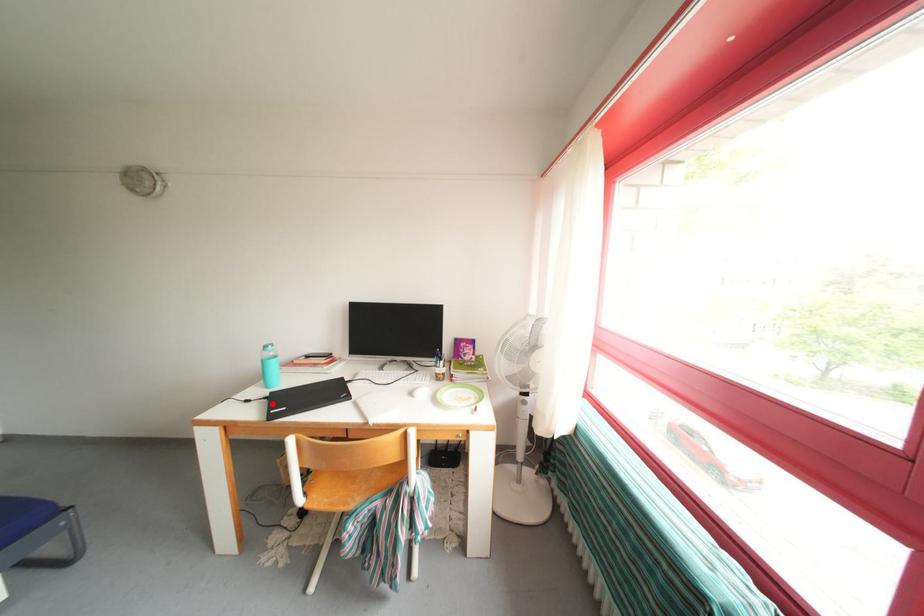
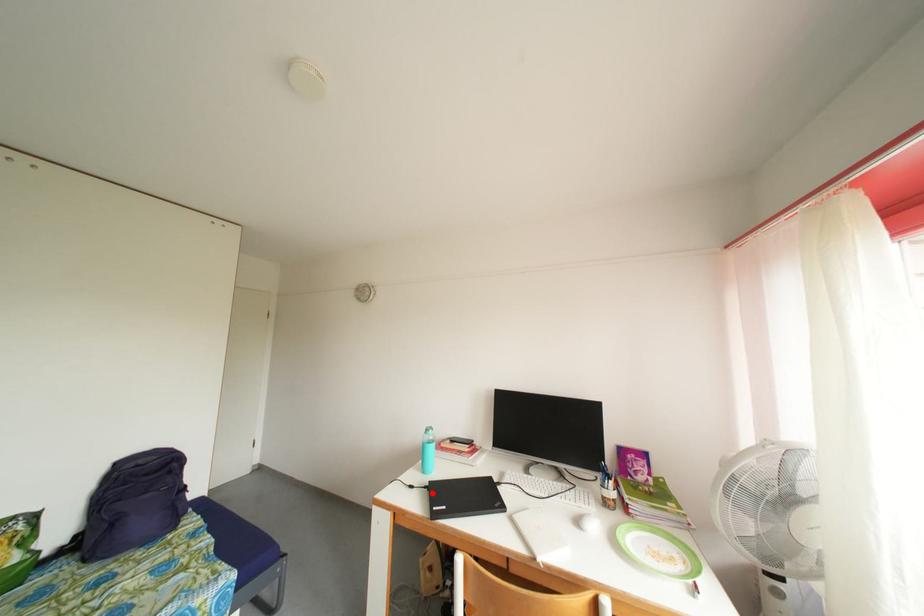
I am providing you with two images of the same scene from different viewpoints. A red point is marked on the first image and another point is marked on the second image. Is the red point in image1 aligned with the point shown in image2?

Yes